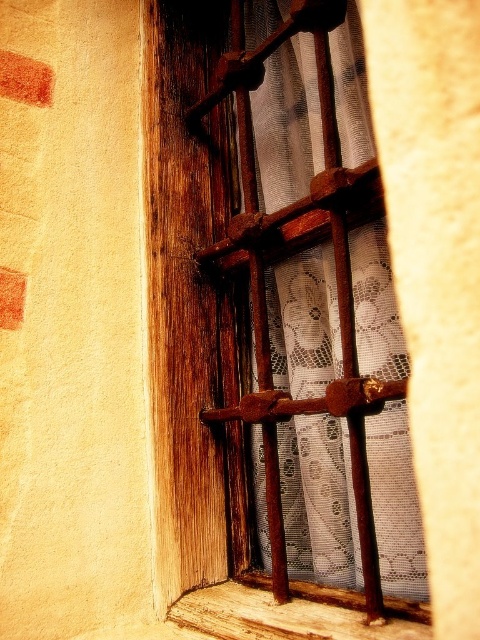
You are standing in front of the window and want to place a small potted plant on the sill. Based on the scene, where exactly should you place the plant to ensure it is on the wooden window sill at lower center and not on the rustic wood window frame at center?

Place the small potted plant on the wooden window sill at lower center, which is located to the right of the rustic wood window frame at center. This ensures the plant is on the sill and not on the window frame.

Looking at this image, you are standing in front of a window with a rustic wood window frame at center. If your eyes are at a height of 5 feet, can you comfortably look through the window without bending down or leaning back?

The rustic wood window frame at center is 24.43 inches away from the viewer. Since 24.43 inches is approximately 2 feet, and your eyes are at 5 feet height, you can comfortably look through the window without bending down or leaning back.

You are an interior designer assessing the rustic wood window frame at center and the wooden window sill at lower center. From the viewer perspective, which object is closer to you?

The rustic wood window frame at center is closer to you because the wooden window sill at lower center is behind it.